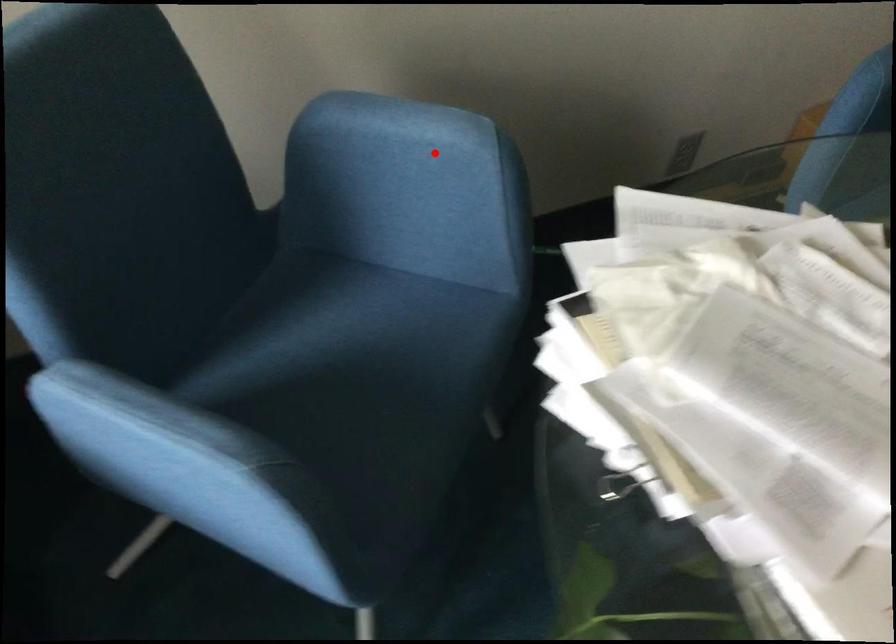
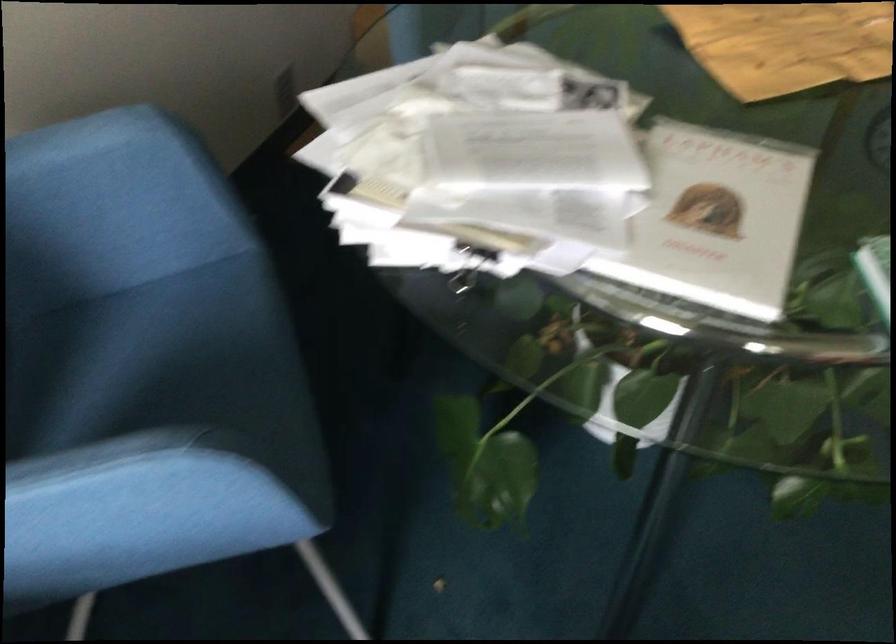
Where in the second image is the point corresponding to the highlighted location from the first image?

(109, 162)